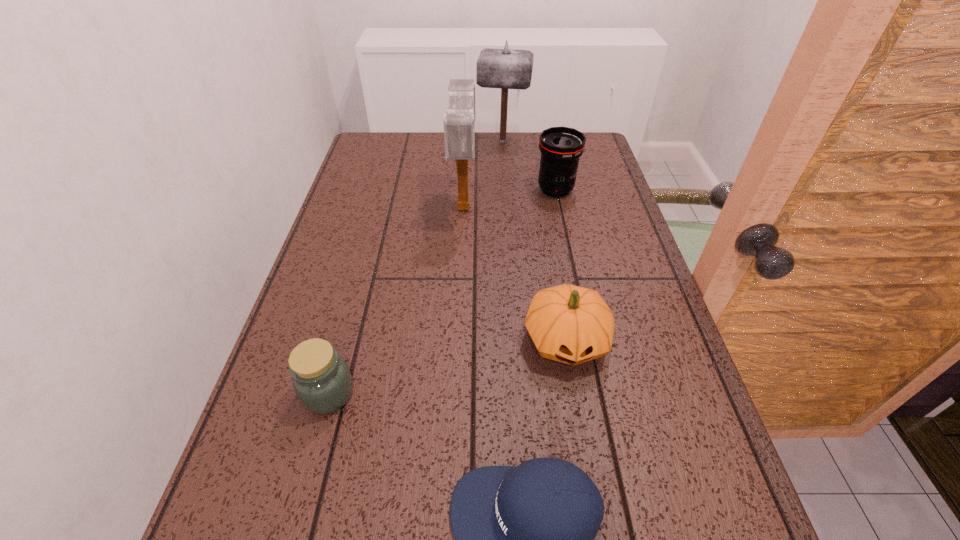
Locate an element on the screen. the farthest object is located at coordinates (506, 68).

At what (x,y) coordinates should I click in order to perform the action: click on the right mallet. Please return your answer as a coordinate pair (x, y). The width and height of the screenshot is (960, 540). Looking at the image, I should click on (506, 68).

The height and width of the screenshot is (540, 960). In order to click on the nearer mallet in this screenshot , I will do `click(459, 131)`.

I want to click on telephoto lens, so click(561, 147).

The image size is (960, 540). Identify the location of gourd. (570, 324).

Locate an element on the screen. This screenshot has height=540, width=960. jar is located at coordinates (322, 381).

Image resolution: width=960 pixels, height=540 pixels. Identify the location of the fifth tallest object. (322, 381).

Locate an element on the screen. The image size is (960, 540). free space located 0.180m on the right of the right mallet is located at coordinates (580, 141).

Where is `vacant space located on the left of the nearer mallet`? The height and width of the screenshot is (540, 960). vacant space located on the left of the nearer mallet is located at coordinates (407, 207).

Where is `vacant area situated on the left of the telephoto lens`? This screenshot has width=960, height=540. vacant area situated on the left of the telephoto lens is located at coordinates [x=459, y=190].